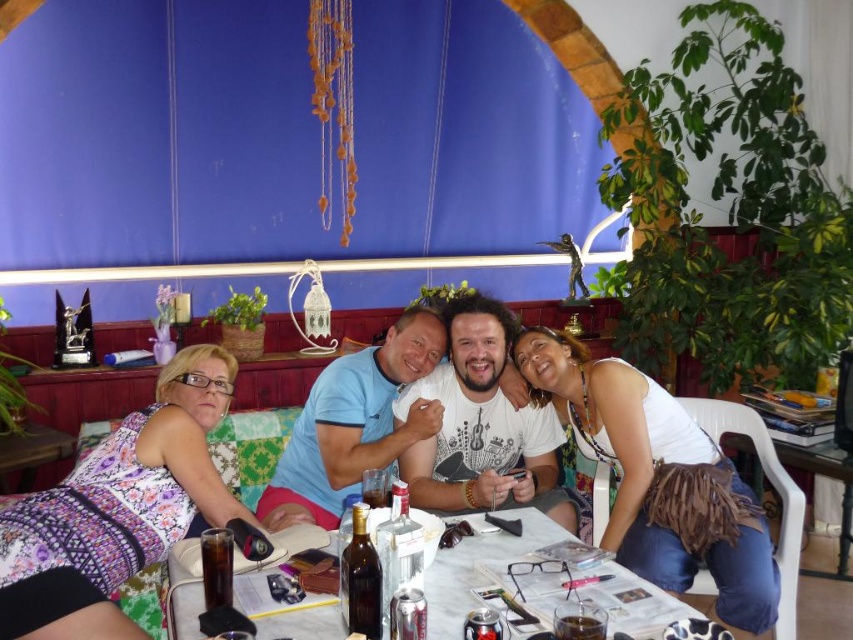
Question: Does purple printed dress at lower left appear on the right side of blue cotton shirt at center?

Choices:
 (A) no
 (B) yes

Answer: (A)

Question: In this image, where is purple printed dress at lower left located relative to blue cotton shirt at center?

Choices:
 (A) left
 (B) right

Answer: (A)

Question: Which point is farther to the camera?

Choices:
 (A) (328, 378)
 (B) (16, 636)
 (C) (546, 358)

Answer: (A)

Question: Which object appears farthest from the camera in this image?

Choices:
 (A) blue cotton shirt at center
 (B) white cotton t-shirt at center

Answer: (B)

Question: Can you confirm if white tank top at center is positioned to the left of white cotton t-shirt at center?

Choices:
 (A) yes
 (B) no

Answer: (B)

Question: Which of the following is the closest to the observer?

Choices:
 (A) (602, 458)
 (B) (444, 428)

Answer: (A)